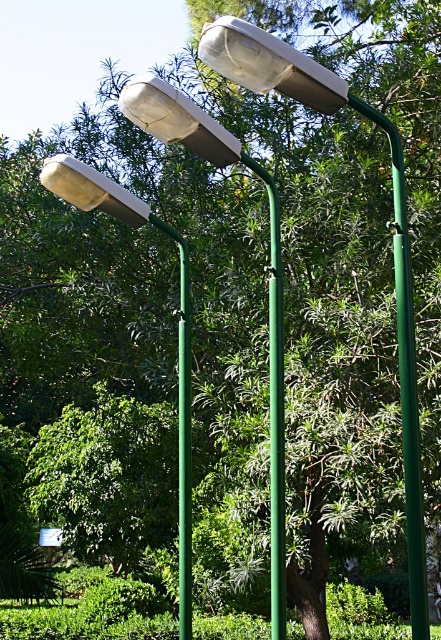
Question: Can you confirm if matte white street light at left is positioned below matte white lamp at upper center?

Choices:
 (A) no
 (B) yes

Answer: (B)

Question: Estimate the real-world distances between objects in this image. Which object is closer to the white matte streetlight at upper center?

Choices:
 (A) matte white lamp at upper left
 (B) green matte pole at center
 (C) matte white street light at left
 (D) matte white lamp at upper center

Answer: (D)

Question: Which object appears farthest from the camera in this image?

Choices:
 (A) matte white street light at left
 (B) matte white lamp at upper center

Answer: (A)

Question: Can you confirm if white matte streetlight at upper center is positioned below matte white lamp at upper left?

Choices:
 (A) yes
 (B) no

Answer: (B)

Question: Can you confirm if matte white street light at left is smaller than green metallic pole at center?

Choices:
 (A) yes
 (B) no

Answer: (B)

Question: Which of the following is the farthest from the observer?

Choices:
 (A) white matte streetlight at upper center
 (B) matte white lamp at upper center
 (C) matte white street light at left

Answer: (C)